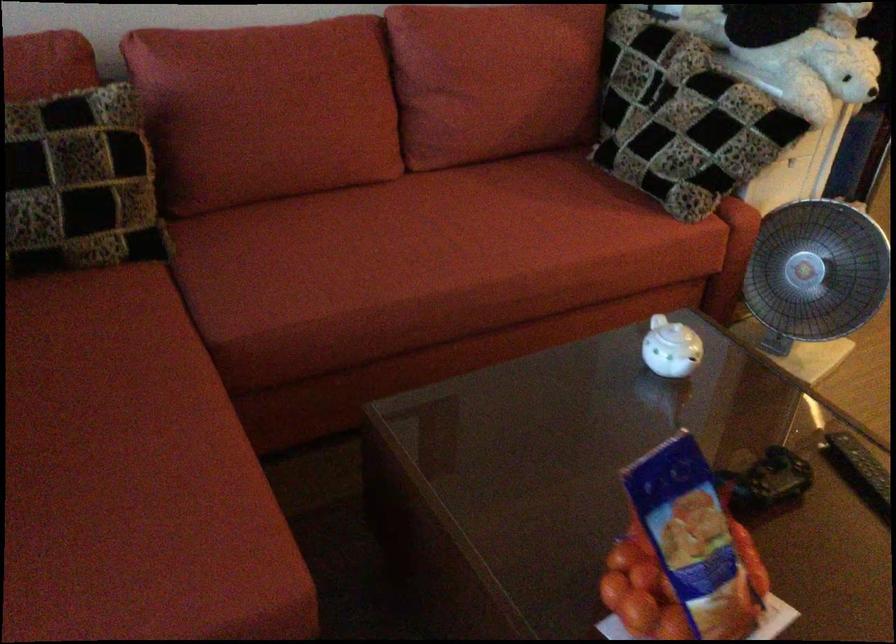
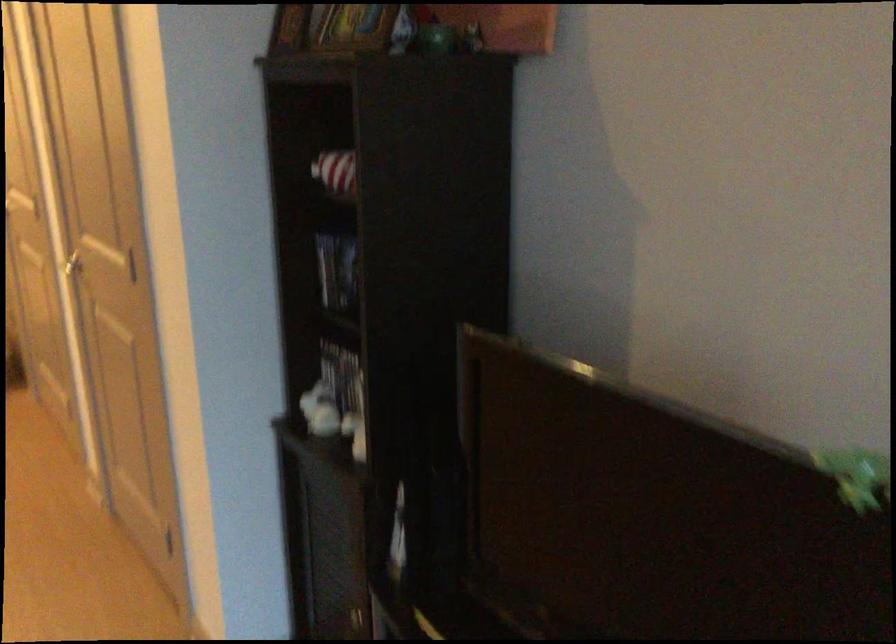
From the picture: The images are taken continuously from a first-person perspective. In which direction is your viewpoint rotating?

The rotation direction of the camera is right-down.